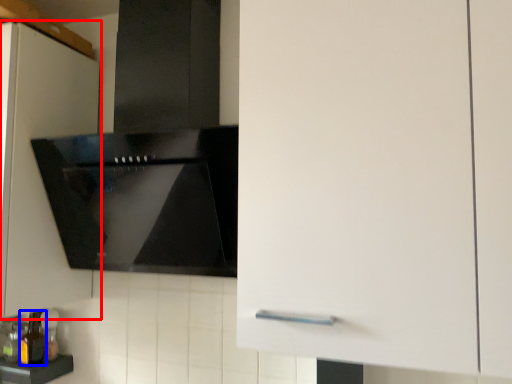
Question: Which of the following is the farthest to the observer, cabinetry (highlighted by a red box) or bottle (highlighted by a blue box)?

Choices:
 (A) cabinetry
 (B) bottle

Answer: (B)